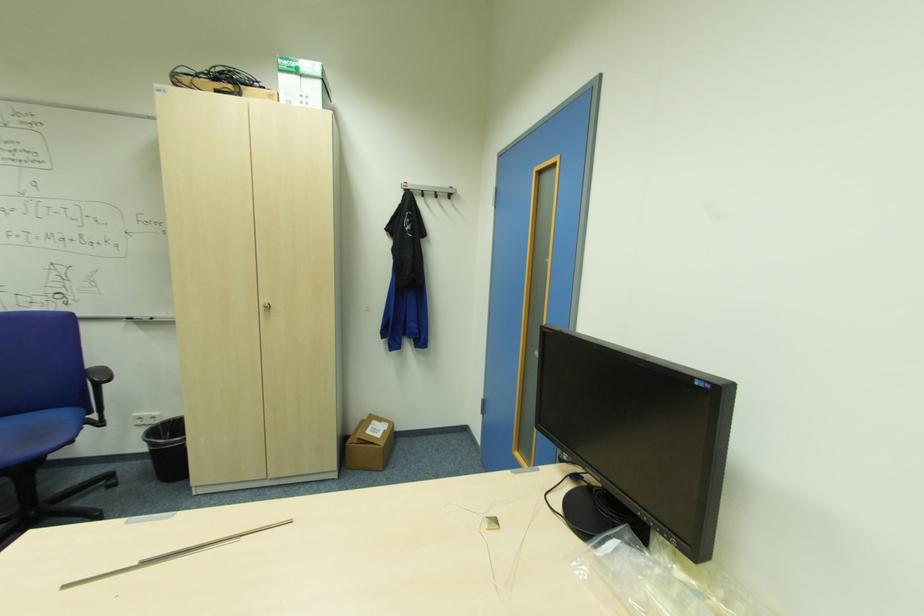
Identify the location of metal rod. Image resolution: width=924 pixels, height=616 pixels. (175, 554).